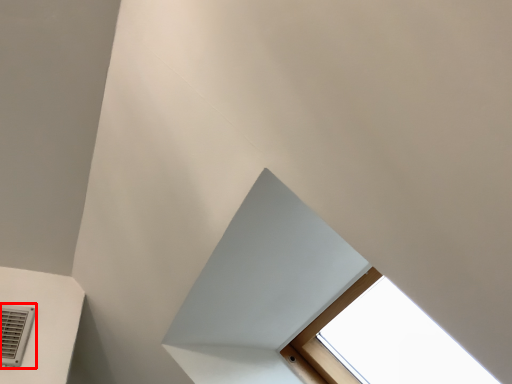
Question: Considering the relative positions of air conditioning (annotated by the red box) and exhaust hood in the image provided, where is air conditioning (annotated by the red box) located with respect to the staircase?

Choices:
 (A) left
 (B) right

Answer: (A)